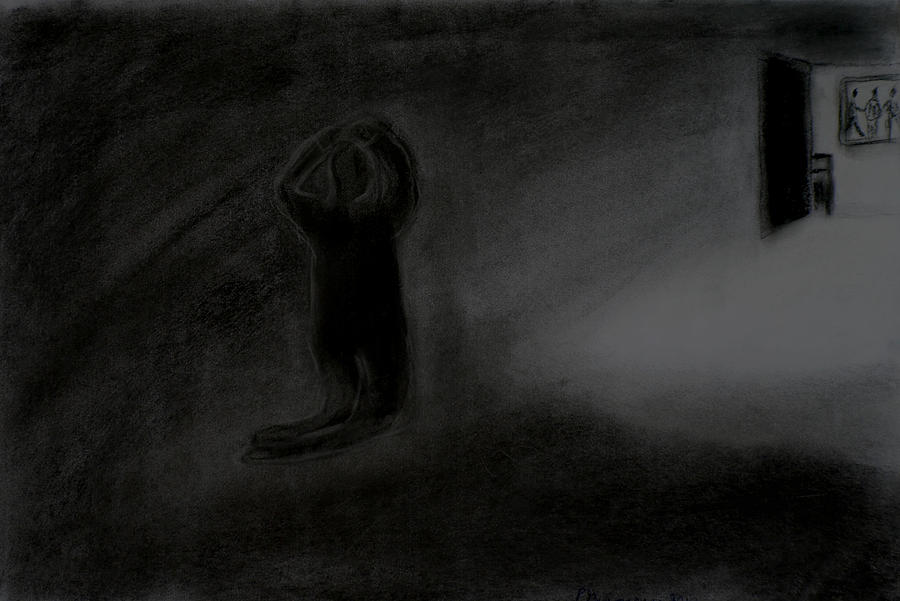
Where is `dark room`? The height and width of the screenshot is (601, 900). dark room is located at coordinates (31, 40).